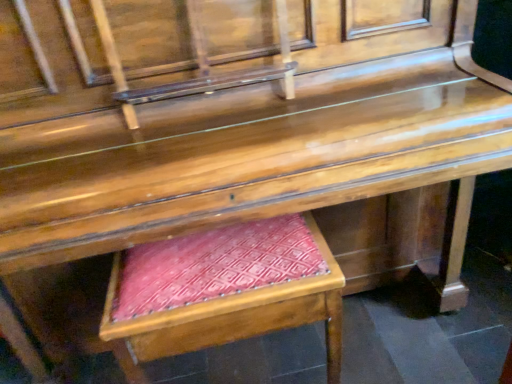
At what (x,y) coordinates should I click in order to perform the action: click on spots to the right of red leather stool at center. Please return your answer as a coordinate pair (x, y). Looking at the image, I should click on (392, 342).